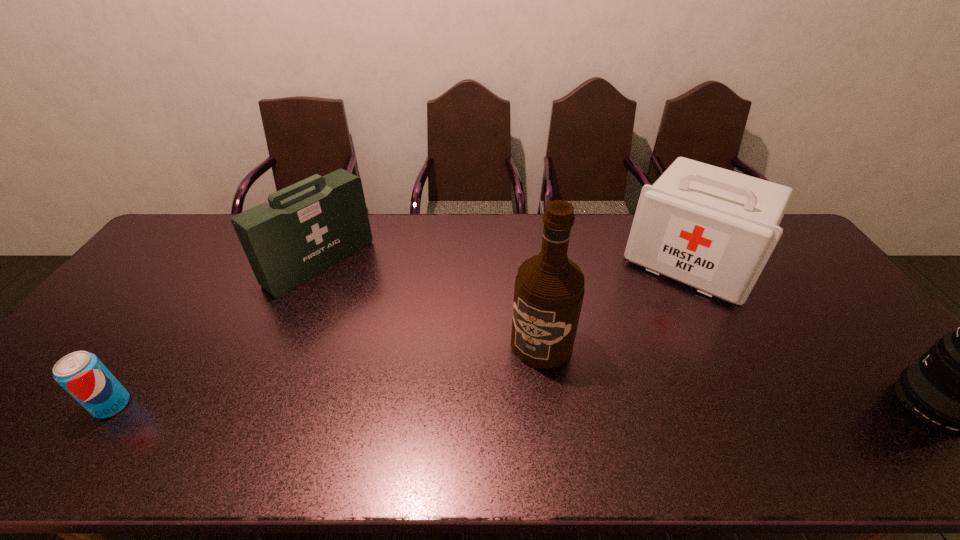
This screenshot has width=960, height=540. What are the coordinates of `free space located 0.230m on the front-facing side of the second object from right to left` in the screenshot? It's located at (636, 346).

Find the location of `vacant space located 0.260m on the front-facing side of the second object from right to left`. vacant space located 0.260m on the front-facing side of the second object from right to left is located at coordinates (633, 353).

Where is `vacant space positioned on the front-facing side of the second object from right to left`? Image resolution: width=960 pixels, height=540 pixels. vacant space positioned on the front-facing side of the second object from right to left is located at coordinates pos(645,333).

The image size is (960, 540). What are the coordinates of `vacant space located on the label of the third object from right to left` in the screenshot? It's located at (507, 397).

Locate an element on the screen. This screenshot has width=960, height=540. free space located on the label of the third object from right to left is located at coordinates (515, 385).

At what (x,y) coordinates should I click in order to perform the action: click on vacant space located on the label of the third object from right to left. Please return your answer as a coordinate pair (x, y). Looking at the image, I should click on (502, 403).

Where is `object situated at the near edge`? This screenshot has height=540, width=960. object situated at the near edge is located at coordinates (81, 374).

The image size is (960, 540). Identify the location of free space at the far edge of the desktop. (617, 232).

This screenshot has width=960, height=540. In the image, there is a desktop. In order to click on free space at the near edge in this screenshot , I will do `click(464, 392)`.

This screenshot has width=960, height=540. What are the coordinates of `blank space at the left edge of the desktop` in the screenshot? It's located at (179, 265).